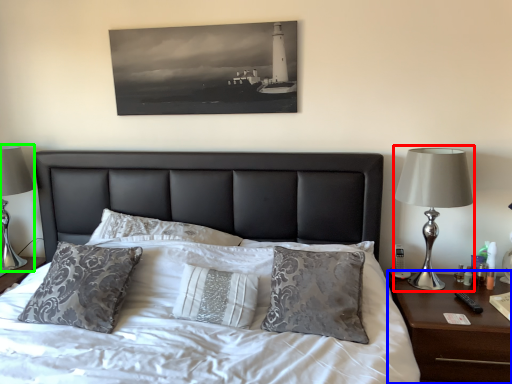
Question: Based on their relative distances, which object is nearer to bedside lamp (highlighted by a red box)? Choose from nightstand (highlighted by a blue box) and table lamp (highlighted by a green box).

Choices:
 (A) nightstand
 (B) table lamp

Answer: (A)